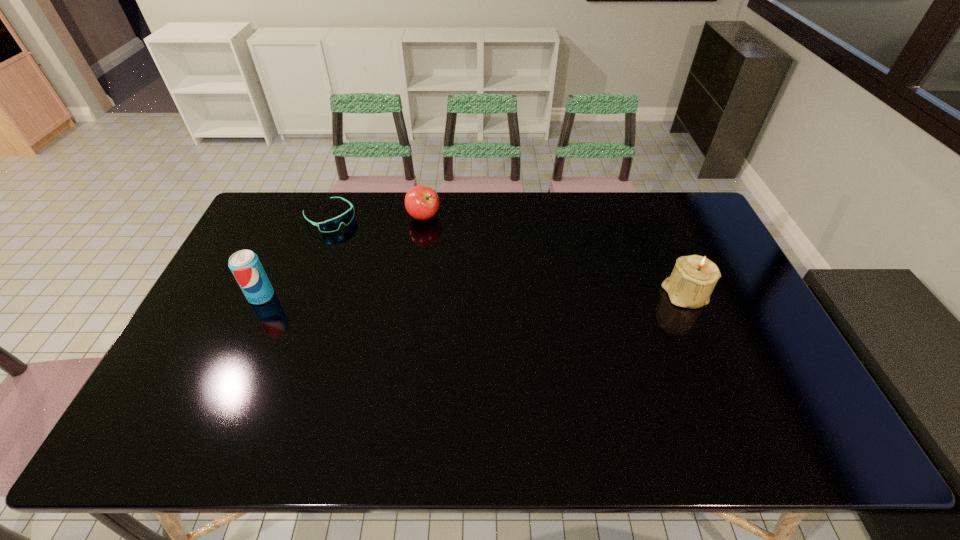
This screenshot has width=960, height=540. Identify the location of soda can. (245, 265).

You are a GUI agent. You are given a task and a screenshot of the screen. Output one action in this format:
    pyautogui.click(x=<x>, y=<y>)
    Task: Click on the candle_holder
    This screenshot has width=960, height=540.
    Given the screenshot: What is the action you would take?
    pyautogui.click(x=692, y=281)

Locate an element on the screen. the second shortest object is located at coordinates (421, 202).

This screenshot has width=960, height=540. I want to click on apple, so click(421, 202).

Where is `sunglasses`? This screenshot has width=960, height=540. sunglasses is located at coordinates (331, 225).

This screenshot has height=540, width=960. Identify the location of free region located on the right of the soda can. (396, 296).

The image size is (960, 540). I want to click on vacant space situated 0.340m on the back of the candle_holder, so click(x=649, y=212).

You are a GUI agent. You are given a task and a screenshot of the screen. Output one action in this format:
    pyautogui.click(x=<x>, y=<y>)
    Task: Click on the vacant space situated on the stem of the apple
    This screenshot has height=540, width=960.
    Given the screenshot: What is the action you would take?
    pyautogui.click(x=422, y=257)

This screenshot has width=960, height=540. Identify the location of free region located 0.330m on the stem of the apple. (421, 299).

Image resolution: width=960 pixels, height=540 pixels. In order to click on free region located 0.270m on the stem of the apple in this screenshot , I will do `click(421, 284)`.